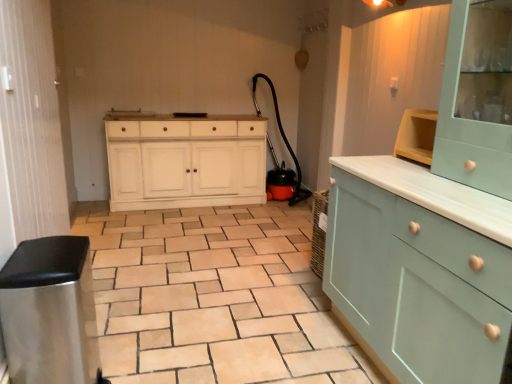
Question: Considering the positions of point (312, 382) and point (138, 163), is point (312, 382) closer or farther from the camera than point (138, 163)?

Choices:
 (A) farther
 (B) closer

Answer: (B)

Question: In terms of size, does beige ceramic tile at center appear bigger or smaller than white painted wood cabinet at center?

Choices:
 (A) big
 (B) small

Answer: (B)

Question: Which object is the closest to the light teal wood cabinet at upper right, arranged as the 2th cabinetry when ordered from the bottom?

Choices:
 (A) light blue wood cabinet at center, the second cabinetry when ordered from top to bottom
 (B) beige ceramic tile at center
 (C) white painted wood cabinet at center

Answer: (A)

Question: Which of these objects is positioned closest to the white painted wood cabinet at center?

Choices:
 (A) light teal wood cabinet at upper right, which is counted as the first cabinetry, starting from the top
 (B) light blue wood cabinet at center, placed as the first cabinetry when sorted from bottom to top
 (C) beige ceramic tile at center

Answer: (C)